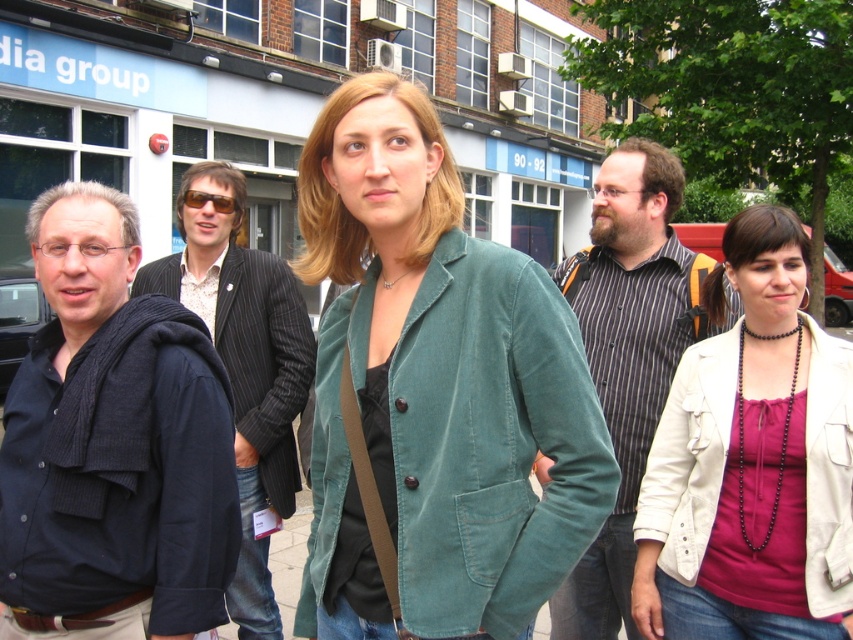
Between teal corduroy jacket at center and striped cotton shirt at center, which one has less height?

With less height is teal corduroy jacket at center.

Can you confirm if teal corduroy jacket at center is shorter than striped cotton shirt at center?

Correct, teal corduroy jacket at center is not as tall as striped cotton shirt at center.

What do you see at coordinates (489, 442) in the screenshot?
I see `teal corduroy jacket at center` at bounding box center [489, 442].

You are a GUI agent. You are given a task and a screenshot of the screen. Output one action in this format:
    pyautogui.click(x=<x>, y=<y>)
    Task: Click on the teal corduroy jacket at center
    The image size is (853, 640).
    Given the screenshot: What is the action you would take?
    pyautogui.click(x=489, y=442)

Does dark blue corduroy jacket at left have a greater height compared to striped cotton shirt at center?

In fact, dark blue corduroy jacket at left may be shorter than striped cotton shirt at center.

Identify the location of dark blue corduroy jacket at left. The image size is (853, 640). (120, 472).

Where is `dark blue corduroy jacket at left`? This screenshot has width=853, height=640. dark blue corduroy jacket at left is located at coordinates (120, 472).

Does teal corduroy jacket at center have a greater width compared to white leather jacket at lower right?

Yes, teal corduroy jacket at center is wider than white leather jacket at lower right.

Measure the distance between teal corduroy jacket at center and camera.

They are 1.58 meters apart.

At what (x,y) coordinates should I click in order to perform the action: click on teal corduroy jacket at center. Please return your answer as a coordinate pair (x, y). This screenshot has height=640, width=853. Looking at the image, I should click on 489,442.